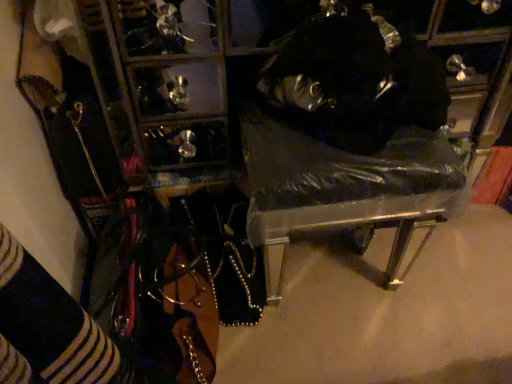
Question: Does clear plastic bag at center appear on the right side of fuzzy black hat at upper right?

Choices:
 (A) no
 (B) yes

Answer: (A)

Question: Is clear plastic bag at center facing away from fuzzy black hat at upper right?

Choices:
 (A) yes
 (B) no

Answer: (B)

Question: Can you confirm if clear plastic bag at center is shorter than fuzzy black hat at upper right?

Choices:
 (A) no
 (B) yes

Answer: (A)

Question: Is clear plastic bag at center outside fuzzy black hat at upper right?

Choices:
 (A) yes
 (B) no

Answer: (A)

Question: Does clear plastic bag at center have a larger size compared to fuzzy black hat at upper right?

Choices:
 (A) no
 (B) yes

Answer: (B)

Question: From the image's perspective, is clear plastic bag at center over fuzzy black hat at upper right?

Choices:
 (A) yes
 (B) no

Answer: (B)

Question: Is fuzzy black hat at upper right at the right side of clear plastic bag at center?

Choices:
 (A) yes
 (B) no

Answer: (A)

Question: Does fuzzy black hat at upper right have a lesser height compared to clear plastic bag at center?

Choices:
 (A) no
 (B) yes

Answer: (B)

Question: Would you say fuzzy black hat at upper right is outside clear plastic bag at center?

Choices:
 (A) yes
 (B) no

Answer: (A)

Question: Can clear plastic bag at center be found inside fuzzy black hat at upper right?

Choices:
 (A) yes
 (B) no

Answer: (B)

Question: Considering the relative sizes of fuzzy black hat at upper right and clear plastic bag at center in the image provided, is fuzzy black hat at upper right taller than clear plastic bag at center?

Choices:
 (A) no
 (B) yes

Answer: (A)

Question: From the image's perspective, is fuzzy black hat at upper right beneath clear plastic bag at center?

Choices:
 (A) yes
 (B) no

Answer: (B)

Question: From a real-world perspective, is clear plastic bag at center positioned above or below fuzzy black hat at upper right?

Choices:
 (A) above
 (B) below

Answer: (B)